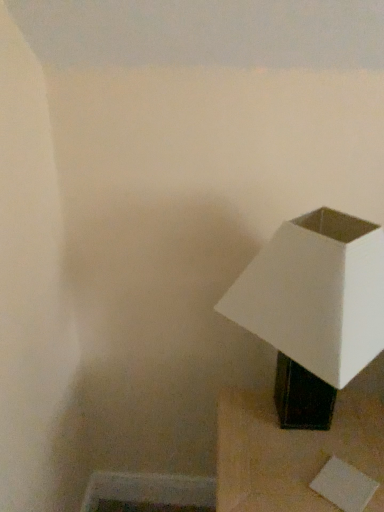
Where is `free location above black matte lamp at lower right (from a real-world perspective)`? The height and width of the screenshot is (512, 384). free location above black matte lamp at lower right (from a real-world perspective) is located at coordinates (314, 443).